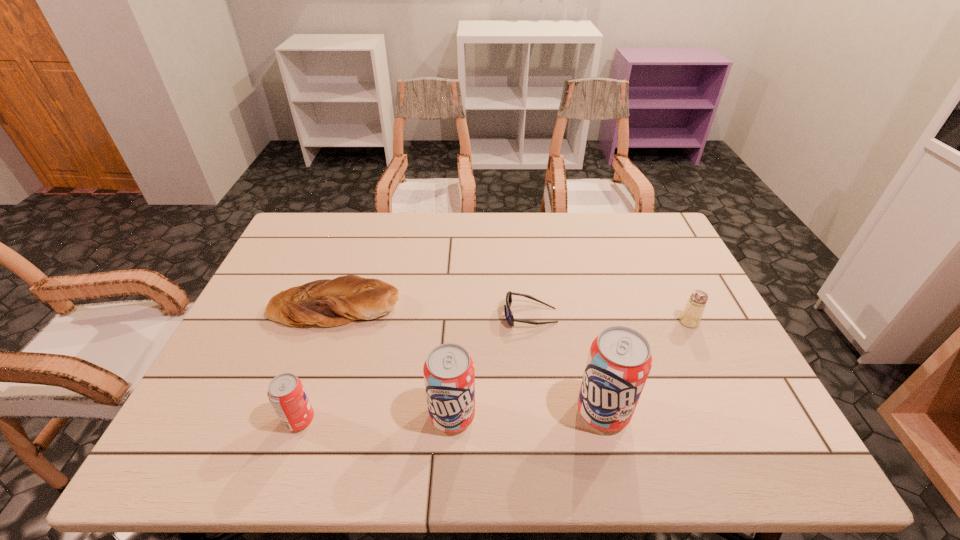
Identify the location of vacant space at the far edge of the desktop. (422, 213).

Where is `blank space at the near edge of the desktop`? blank space at the near edge of the desktop is located at coordinates coord(383,393).

Where is `blank space at the left edge of the desktop`? blank space at the left edge of the desktop is located at coordinates (234, 348).

This screenshot has width=960, height=540. In the image, there is a desktop. What are the coordinates of `vacant space at the right edge` in the screenshot? It's located at (673, 301).

You are a GUI agent. You are given a task and a screenshot of the screen. Output one action in this format:
    pyautogui.click(x=<x>, y=<y>)
    Task: Click on the free space at the far left corner of the desktop
    This screenshot has height=540, width=960.
    Given the screenshot: What is the action you would take?
    pyautogui.click(x=317, y=237)

You are a GUI agent. You are given a task and a screenshot of the screen. Output one action in this format:
    pyautogui.click(x=<x>, y=<y>)
    Task: Click on the free space at the far right corner of the desktop
    
    Given the screenshot: What is the action you would take?
    pyautogui.click(x=660, y=249)

Where is `vacant space at the near right corner of the desktop`? Image resolution: width=960 pixels, height=540 pixels. vacant space at the near right corner of the desktop is located at coordinates (747, 409).

Image resolution: width=960 pixels, height=540 pixels. Identify the location of blank region between the second tallest soda can and the shortest soda can. (375, 418).

You are a GUI agent. You are given a task and a screenshot of the screen. Output one action in this format:
    pyautogui.click(x=<x>, y=<y>)
    Task: Click on the vacant area between the second object from right to left and the third object from left to right
    The width and height of the screenshot is (960, 540).
    Given the screenshot: What is the action you would take?
    pyautogui.click(x=528, y=414)

At what (x,y) coordinates should I click in order to perform the action: click on free space between the saltshaker and the third object from right to left. Please return your answer as a coordinate pair (x, y). The image size is (960, 540). Looking at the image, I should click on (610, 319).